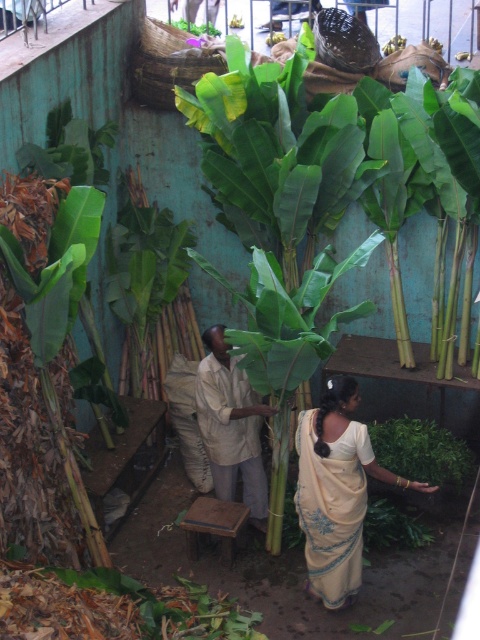
You are a photographer trying to capture a photo of the beige silk saree at center and the green leafy plant at center. If your camera has a maximum focus range of 6 meters, will you be able to capture both subjects in focus at the same time?

The beige silk saree at center is 7.13 meters away from the green leafy plant at center, which exceeds the camera maximum focus range of 6 meters. Therefore, you cannot capture both subjects in focus simultaneously.

You are standing in the market scene and want to determine which of the two points, point [267,410] or point [436,477], is nearer to you. Based on the spatial arrangement, which point is closer?

Point [267,410] is closer to the viewer than point [436,477].

Consider the image. You are a customer at the market and want to buy the green leafy plant at center. However, you notice the beige silk saree at center is blocking your view. Which object should you move to get a better look at the plant?

You should move the beige silk saree at center, as it is located below the green leafy plant at center and is blocking the view.